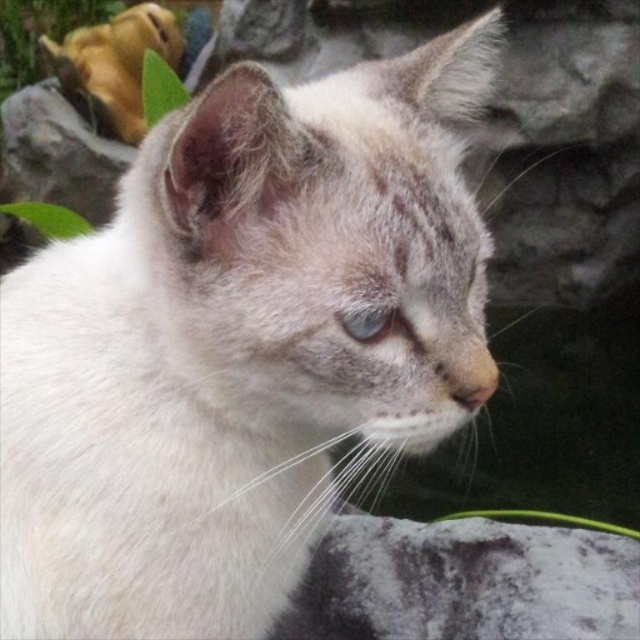
Question: Can you confirm if fuzzy gray stone at lower right is positioned to the left of blue glossy eye at center?

Choices:
 (A) yes
 (B) no

Answer: (B)

Question: Can you confirm if fuzzy gray stone at lower right is bigger than blue glossy eye at center?

Choices:
 (A) no
 (B) yes

Answer: (B)

Question: Is fuzzy gray stone at lower right thinner than blue glossy eye at center?

Choices:
 (A) yes
 (B) no

Answer: (B)

Question: Which point is farther from the camera taking this photo?

Choices:
 (A) (358, 337)
 (B) (605, 556)

Answer: (B)

Question: Among these points, which one is farthest from the camera?

Choices:
 (A) (394, 324)
 (B) (520, 625)

Answer: (B)